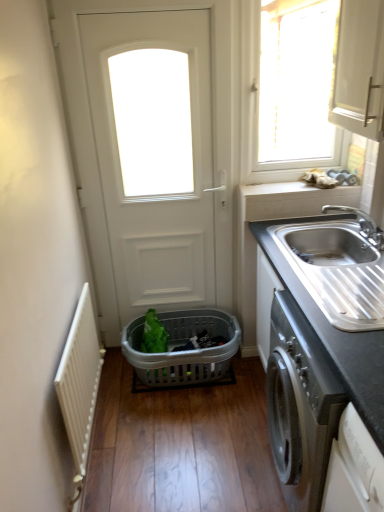
Question: From the image's perspective, is white plastic window at upper right located above or below white painted metal radiator at left?

Choices:
 (A) below
 (B) above

Answer: (B)

Question: Considering the relative positions of white plastic window at upper right and white painted metal radiator at left in the image provided, is white plastic window at upper right to the left or to the right of white painted metal radiator at left?

Choices:
 (A) left
 (B) right

Answer: (B)

Question: Based on their relative distances, which object is farther from the stainless steel sink at right?

Choices:
 (A) white matte door at center
 (B) white plastic window at upper right
 (C) black granite countertop at right
 (D) silver metallic faucet at sink right
 (E) white painted metal radiator at left

Answer: (B)

Question: Considering the real-world distances, which object is farthest from the white matte door at center?

Choices:
 (A) black granite countertop at right
 (B) gray plastic basket at center
 (C) silver metallic faucet at sink right
 (D) white plastic window at upper right
 (E) white painted metal radiator at left

Answer: (D)